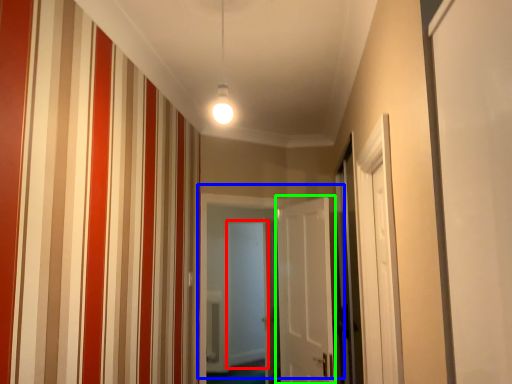
Question: Based on their relative distances, which object is farther from screen door (highlighted by a red box)? Choose from door (highlighted by a blue box) and door (highlighted by a green box).

Choices:
 (A) door
 (B) door

Answer: (A)